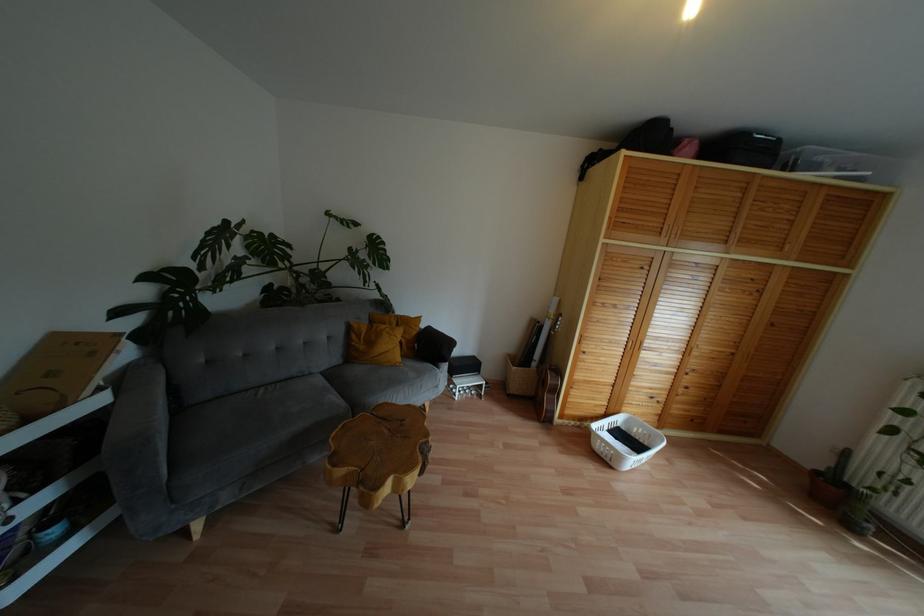
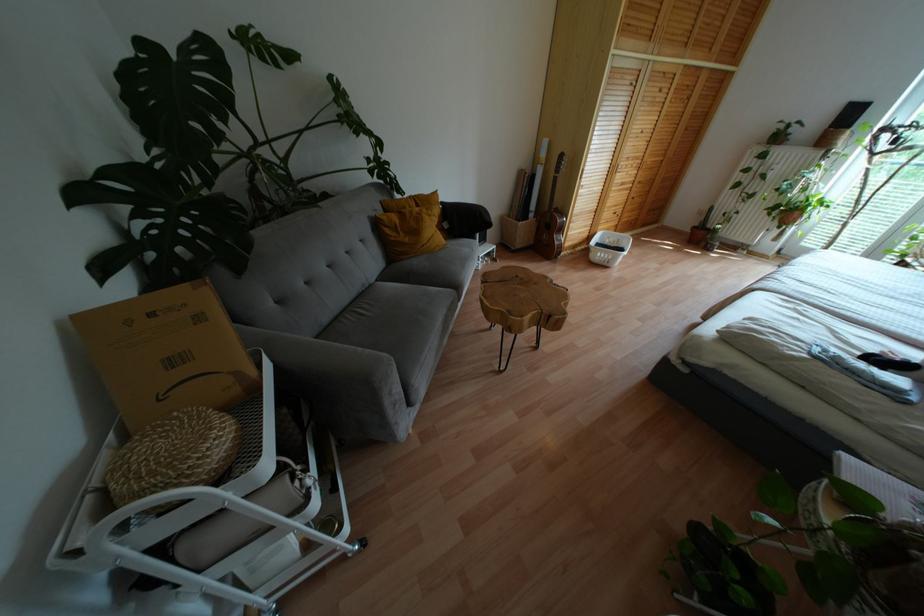
Find the pixel in the second image that matches [819,472] in the first image.

(694, 227)